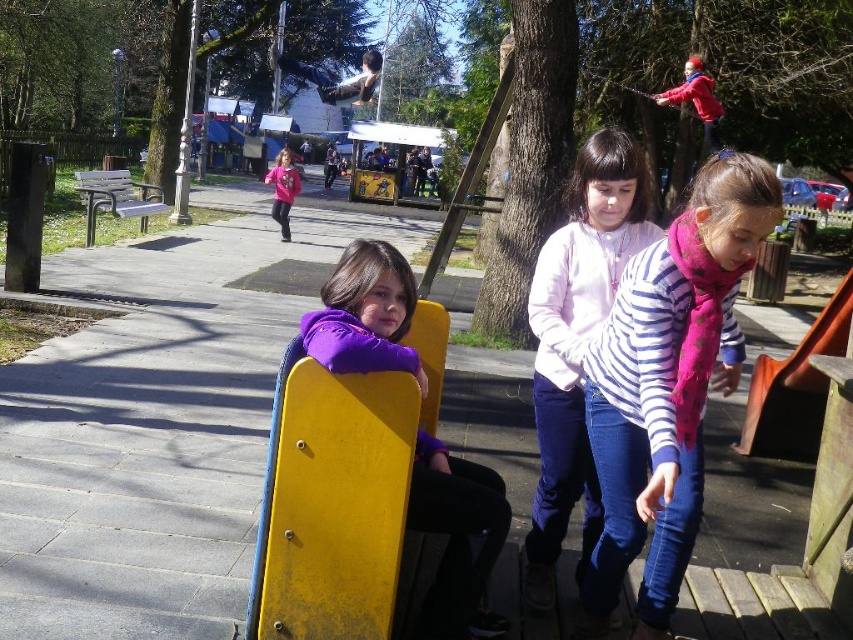
What do you see at coordinates (668, 385) in the screenshot? I see `striped cotton shirt at center` at bounding box center [668, 385].

What are the coordinates of `striped cotton shirt at center` in the screenshot? It's located at (668, 385).

The width and height of the screenshot is (853, 640). Identify the location of striped cotton shirt at center. 668,385.

In the scene shown: Can you confirm if purple matte jacket at center is thinner than pink fleece jacket at center?

Correct, purple matte jacket at center's width is less than pink fleece jacket at center's.

Does purple matte jacket at center come behind pink fleece jacket at center?

No, it is not.

Which is behind, point (422, 461) or point (289, 205)?

Positioned behind is point (289, 205).

Find the location of a particular element. The width and height of the screenshot is (853, 640). purple matte jacket at center is located at coordinates (457, 540).

Between pink fabric shirt at center and purple matte jacket at center, which one has more height?

pink fabric shirt at center is taller.

Is point (590, 157) closer to camera compared to point (473, 522)?

No, (590, 157) is behind (473, 522).

Where is `pink fabric shirt at center`? pink fabric shirt at center is located at coordinates (577, 340).